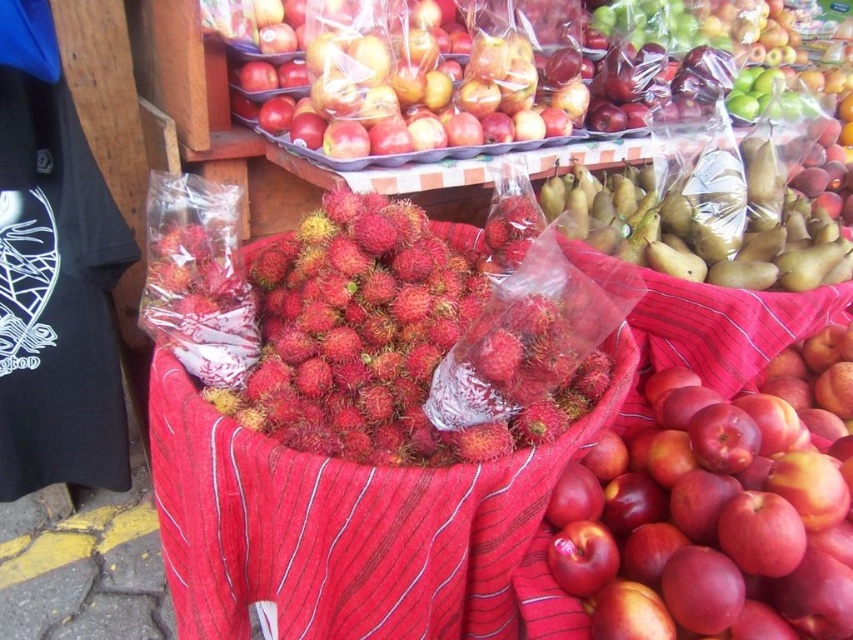
Which is above, glossy red apple at center or ruddy hairy rambutan at center?

ruddy hairy rambutan at center is higher up.

Is point (766, 524) positioned behind point (332, 300)?

That is False.

What do you see at coordinates (717, 509) in the screenshot?
I see `glossy red apple at center` at bounding box center [717, 509].

Find the location of a particular element. Image resolution: width=853 pixels, height=640 pixels. glossy red apple at center is located at coordinates (717, 509).

Is glossy red apple at center behind green matte pears at center?

No.

Is point (718, 474) positioned in front of point (646, 253)?

Yes, point (718, 474) is closer to viewer.

Where is `glossy red apple at center`? glossy red apple at center is located at coordinates (717, 509).

The image size is (853, 640). Find the location of `glossy red apple at center`. glossy red apple at center is located at coordinates (717, 509).

Which is in front, point (299, 372) or point (682, 227)?

Point (299, 372) is in front.

Does ruddy hairy rambutan at center have a larger size compared to green matte pears at center?

Actually, ruddy hairy rambutan at center might be smaller than green matte pears at center.

Does point (395, 216) lie in front of point (608, 243)?

Yes, point (395, 216) is in front of point (608, 243).

You are a GUI agent. You are given a task and a screenshot of the screen. Output one action in this format:
    pyautogui.click(x=<x>, y=<y>)
    Task: Click on the ruddy hairy rambutan at center
    
    Given the screenshot: What is the action you would take?
    pyautogui.click(x=376, y=340)